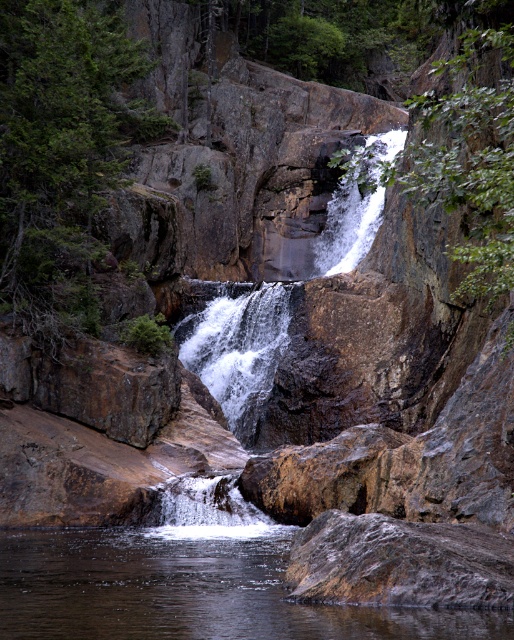
Question: Does rough stone waterfall at center appear on the right side of white frothy water at center?

Choices:
 (A) no
 (B) yes

Answer: (B)

Question: Is the position of clear water at center more distant than that of rough stone waterfall at center?

Choices:
 (A) no
 (B) yes

Answer: (A)

Question: Estimate the real-world distances between objects in this image. Which object is farther from the clear water at center?

Choices:
 (A) white frothy water at center
 (B) rough stone waterfall at center

Answer: (B)

Question: Which point is closer to the camera?

Choices:
 (A) rough stone waterfall at center
 (B) clear water at center
 (C) white frothy water at center

Answer: (B)

Question: Can you confirm if rough stone waterfall at center is positioned to the left of white frothy water at center?

Choices:
 (A) no
 (B) yes

Answer: (A)

Question: Which is nearer to the white frothy water at center?

Choices:
 (A) clear water at center
 (B) rough stone waterfall at center

Answer: (B)